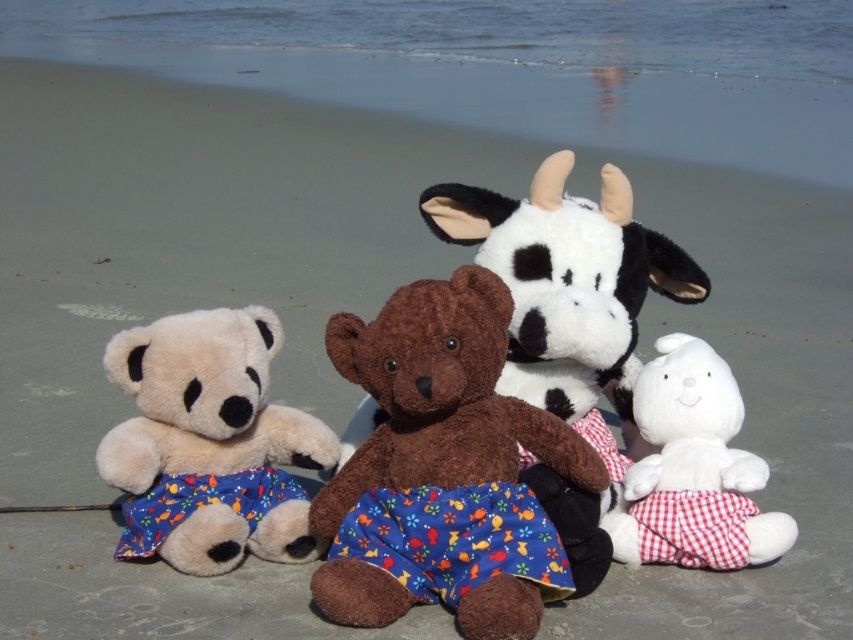
Question: Which object is the closest to the brown plush bear at center?

Choices:
 (A) white plush rabbit at lower right
 (B) fluffy beige teddy bear at left

Answer: (B)

Question: Which of the following is the farthest from the observer?

Choices:
 (A) (544, 516)
 (B) (134, 417)

Answer: (B)

Question: Which object is farther from the camera taking this photo?

Choices:
 (A) brown plush bear at center
 (B) white plush rabbit at lower right
 (C) fluffy beige teddy bear at left

Answer: (B)

Question: Does brown plush bear at center have a lesser width compared to white plush rabbit at lower right?

Choices:
 (A) yes
 (B) no

Answer: (B)

Question: Does fluffy beige teddy bear at left come in front of white plush rabbit at lower right?

Choices:
 (A) yes
 (B) no

Answer: (A)

Question: Observing the image, what is the correct spatial positioning of fluffy beige teddy bear at left in reference to white plush rabbit at lower right?

Choices:
 (A) left
 (B) right

Answer: (A)